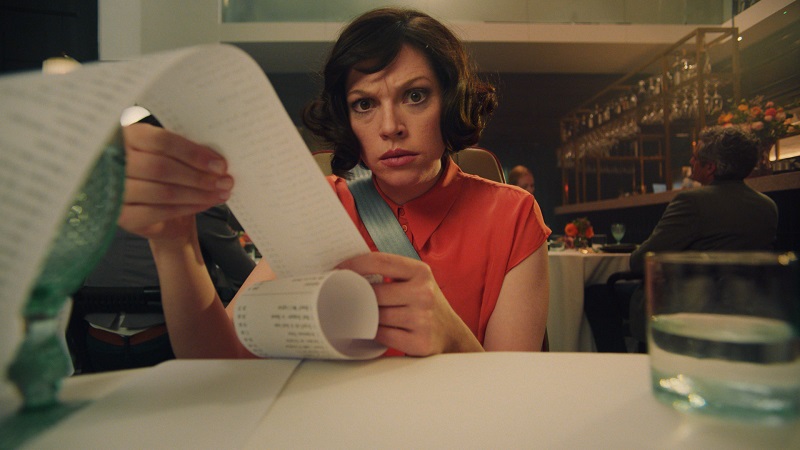
The image size is (800, 450). Identify the location of ceiling. (549, 38).